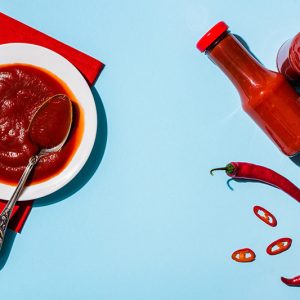
In order to click on bottle of red sauce in this screenshot , I will do `click(251, 82)`.